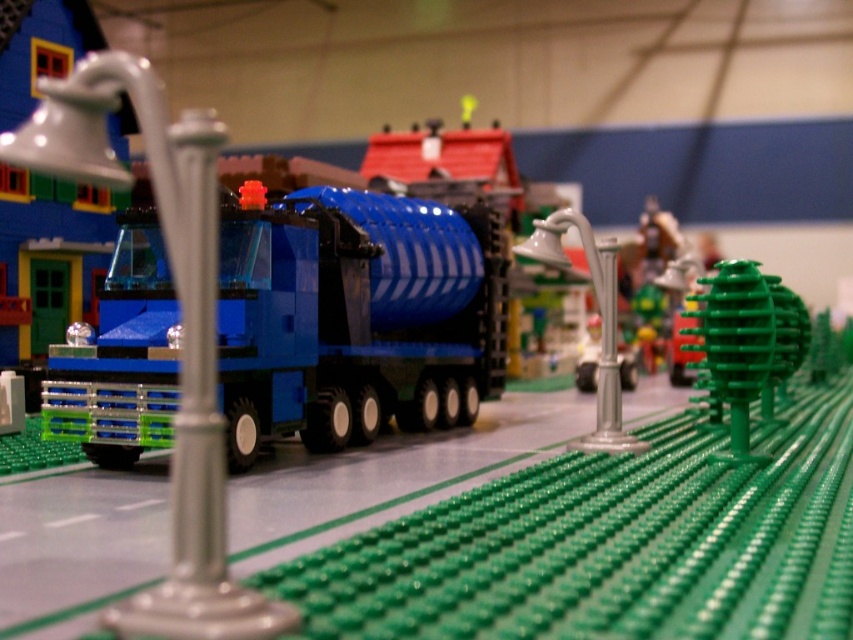
Question: Does green matte tree at center right appear under metallic silver faucet at center?

Choices:
 (A) no
 (B) yes

Answer: (B)

Question: Which is nearer to the green matte tree at center right?

Choices:
 (A) metallic silver faucet at center
 (B) matte blue plastic truck at center

Answer: (A)

Question: Is green matte tree at center right thinner than metallic silver faucet at center?

Choices:
 (A) no
 (B) yes

Answer: (A)

Question: Which of the following is the farthest from the observer?

Choices:
 (A) (747, 294)
 (B) (311, 385)

Answer: (B)

Question: Which of the following is the closest to the observer?

Choices:
 (A) metallic silver faucet at center
 (B) green matte tree at center right

Answer: (B)

Question: Does matte blue plastic truck at center appear on the right side of green matte tree at center right?

Choices:
 (A) yes
 (B) no

Answer: (B)